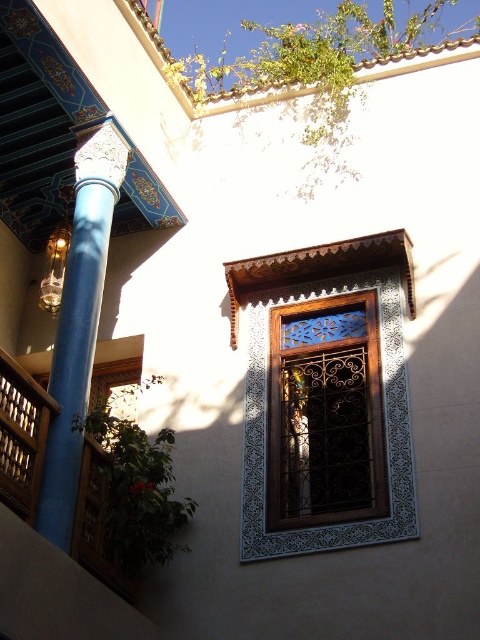
Who is lower down, wooden lattice window at center or blue glossy column at left?

wooden lattice window at center

Does wooden lattice window at center have a smaller size compared to blue glossy column at left?

Correct, wooden lattice window at center occupies less space than blue glossy column at left.

Locate an element on the screen. The width and height of the screenshot is (480, 640). wooden lattice window at center is located at coordinates (324, 413).

Can you confirm if wooden at left is positioned below clear glass lamp at left?

Correct, wooden at left is located below clear glass lamp at left.

Between wooden at left and clear glass lamp at left, which one has more height?

wooden at left is taller.

Who is more distant from viewer, [32,445] or [59,243]?

The point [59,243] is more distant.

This screenshot has width=480, height=640. I want to click on wooden at left, so click(x=22, y=436).

Is wooden lattice window at center further to the viewer compared to wooden at left?

Yes, it is.

Is wooden lattice window at center above wooden at left?

Indeed, wooden lattice window at center is positioned over wooden at left.

Identify the location of wooden lattice window at center. (324, 413).